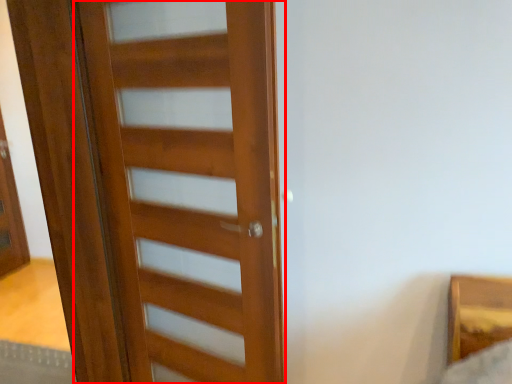
Question: In this image, where is door (annotated by the red box) located relative to screen door?

Choices:
 (A) left
 (B) right

Answer: (B)